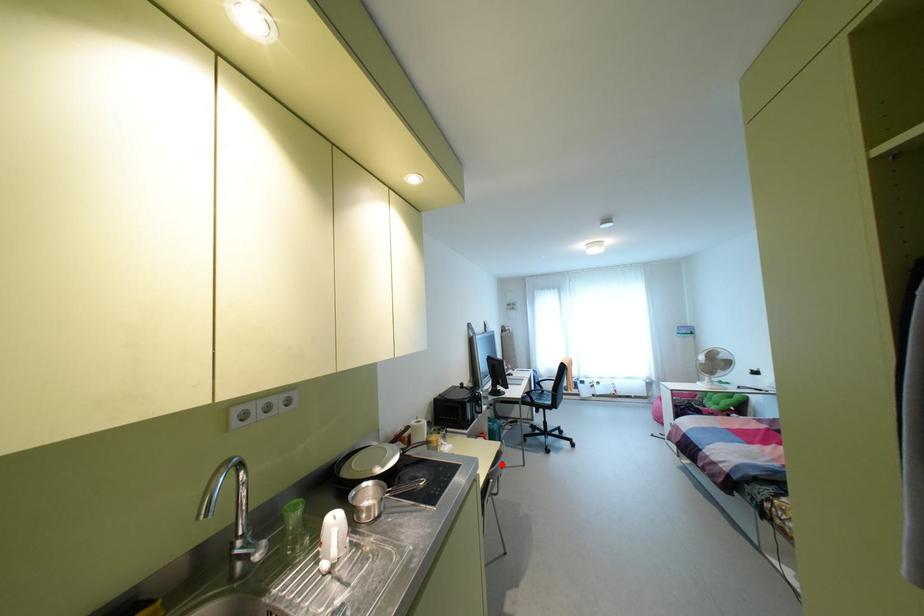
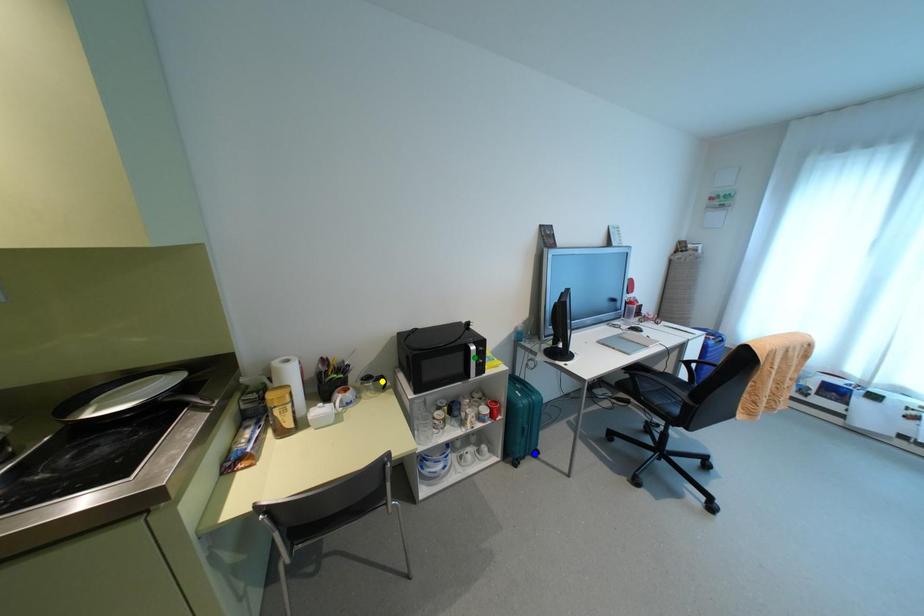
Question: I am providing you with two images of the same scene from different viewpoints. A red point is marked on the first image. You are given multiple points on the second image. Which spot in image 2 lines up with the point in image 1?

Choices:
 (A) green point
 (B) yellow point
 (C) blue point

Answer: (C)